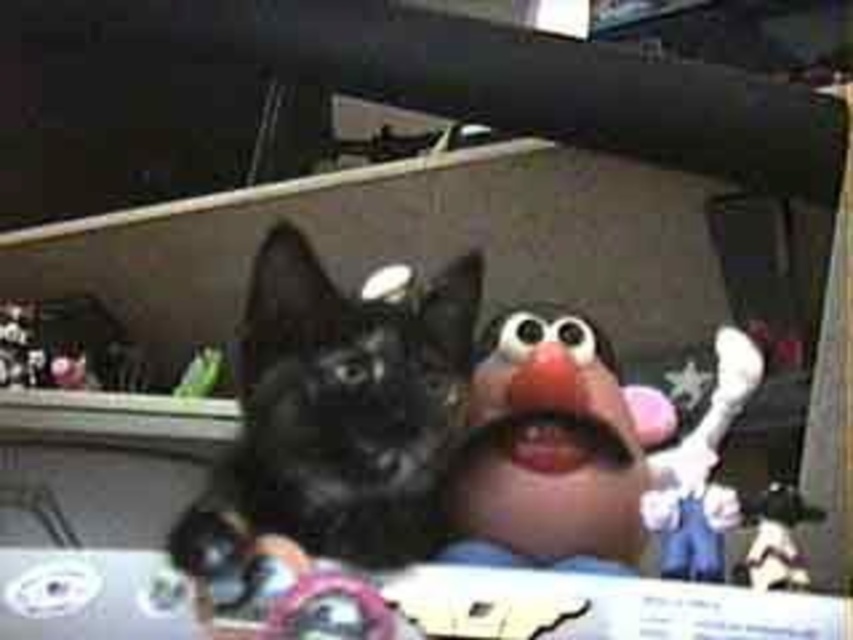
Question: Can you confirm if black fur cat at center is thinner than matte plastic puppet at center?

Choices:
 (A) yes
 (B) no

Answer: (A)

Question: Can you confirm if black fur cat at center is bigger than matte plastic puppet at center?

Choices:
 (A) no
 (B) yes

Answer: (A)

Question: Which point is farther from the camera taking this photo?

Choices:
 (A) (351, 476)
 (B) (596, 396)

Answer: (B)

Question: Where is black fur cat at center located in relation to matte plastic puppet at center in the image?

Choices:
 (A) below
 (B) above

Answer: (B)